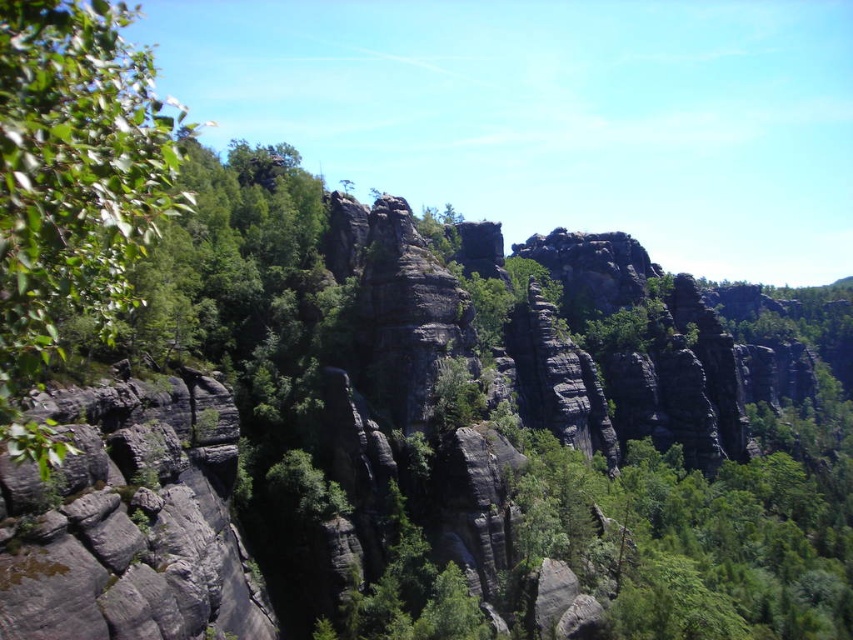
Question: Which point is farther from the camera taking this photo?

Choices:
 (A) 125,8
 (B) 109,621

Answer: (B)

Question: Is green leafy tree at left bigger than gray rough rock at left?

Choices:
 (A) yes
 (B) no

Answer: (A)

Question: Among these objects, which one is nearest to the camera?

Choices:
 (A) gray rough rock at left
 (B) green leafy tree at left

Answer: (B)

Question: Is the position of green leafy tree at left less distant than that of gray rough rock at left?

Choices:
 (A) yes
 (B) no

Answer: (A)

Question: Does green leafy tree at left have a greater width compared to gray rough rock at left?

Choices:
 (A) no
 (B) yes

Answer: (B)